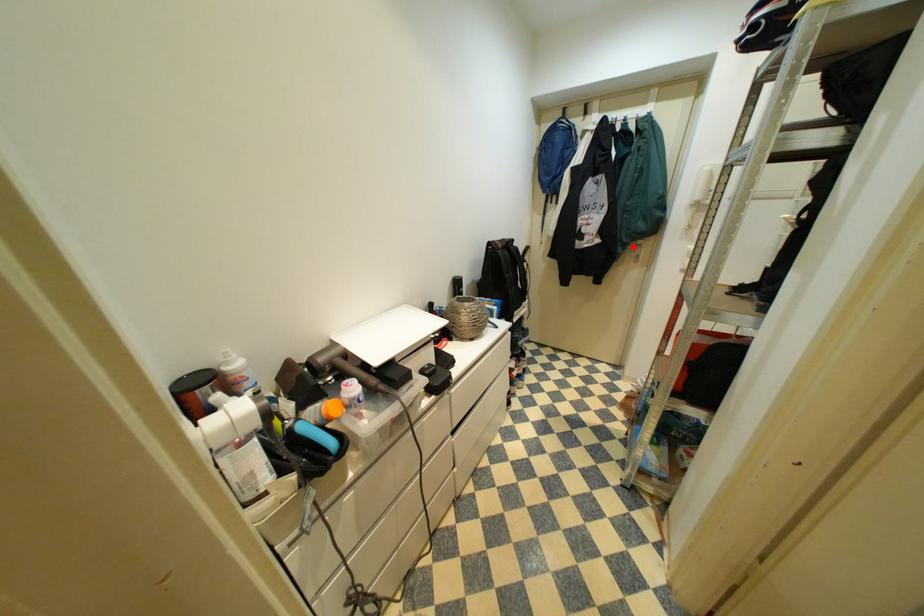
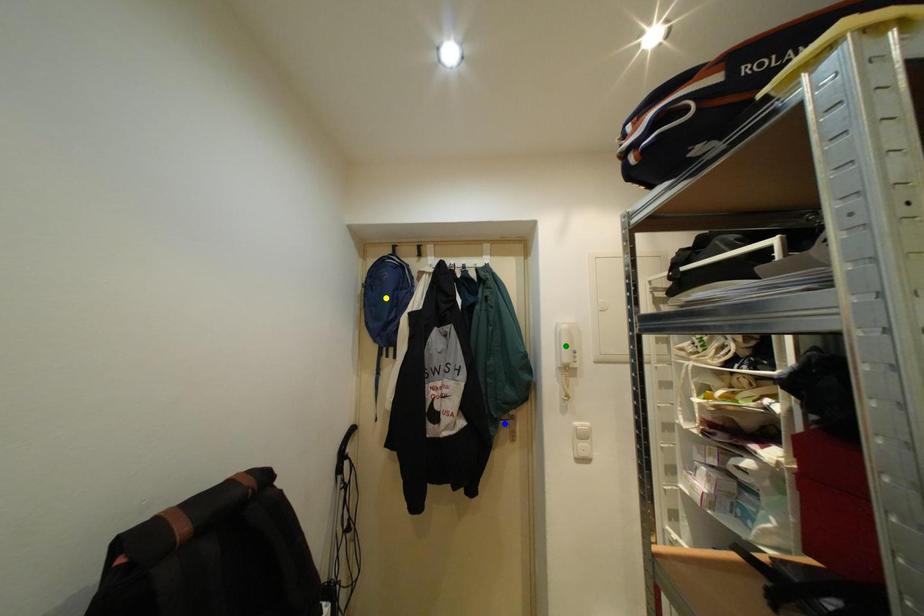
Question: I am providing you with two images of the same scene from different viewpoints. A red point is marked on the first image. You are given multiple points on the second image. Can you choose the point in image 2 that corresponds to the point in image 1?

Choices:
 (A) green point
 (B) blue point
 (C) yellow point

Answer: (B)